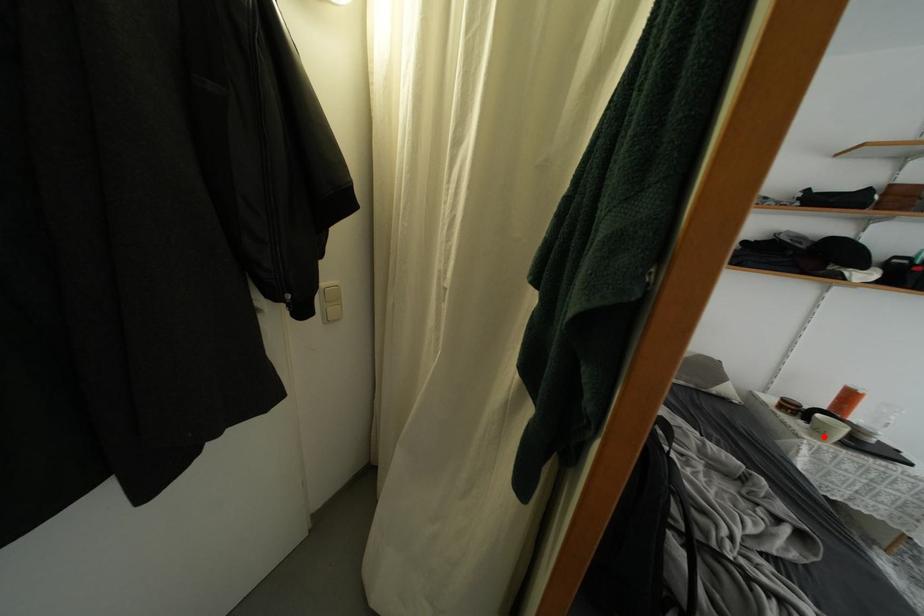
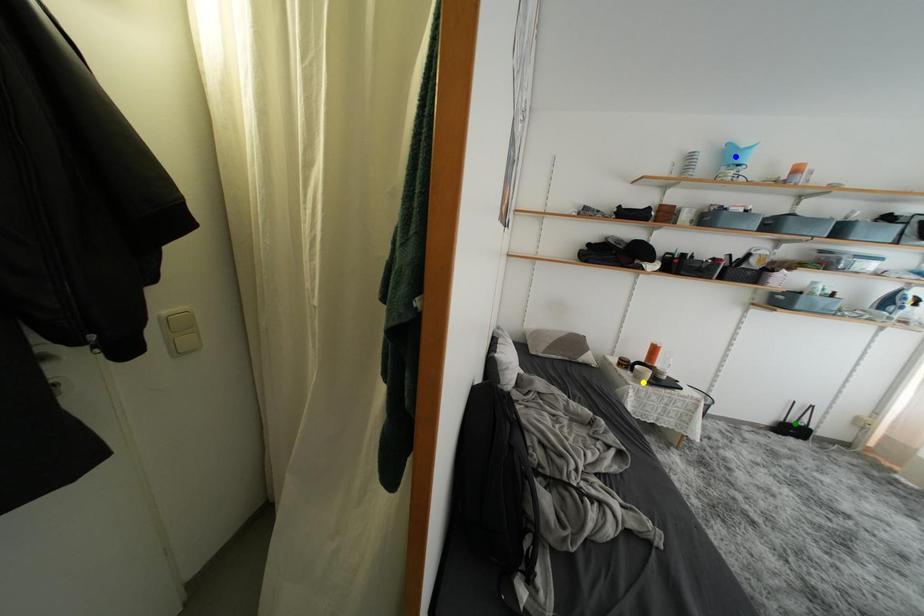
Question: I am providing you with two images of the same scene from different viewpoints. A red point is marked on the first image. You are given multiple points on the second image. Which point in image 2 represents the same 3d spot as the red point in image 1?

Choices:
 (A) yellow point
 (B) blue point
 (C) green point

Answer: (A)